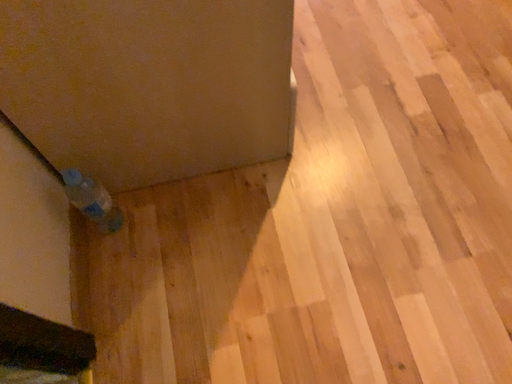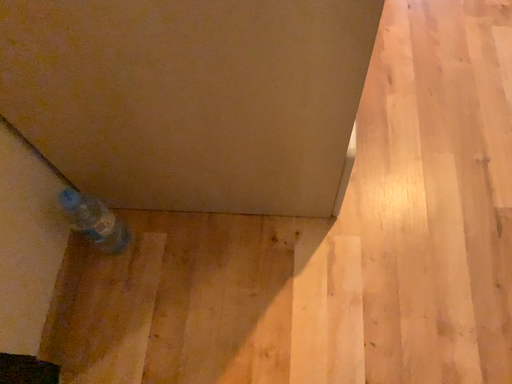
Question: Which way did the camera rotate in the video?

Choices:
 (A) rotated left
 (B) rotated right

Answer: (A)